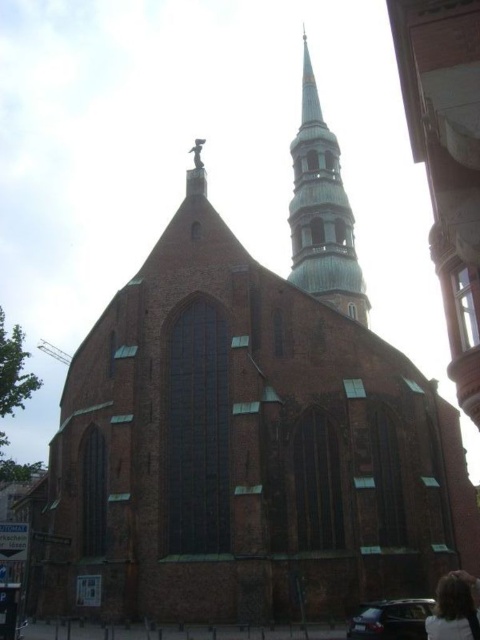
You are standing in front of the historic church and notice two points marked on its facade. The first point is located at coordinates point (349, 268), and the second at point (454, 580). Which of these points is closer to you?

Point (349, 268) is closer to you because it is further to the viewer than point (454, 580).

Based on the scene description, what object is located at the coordinates point (322, 211)?

The green copper spire at upper center is located at point (322, 211).

You are standing in front of the church and notice two elements in the image. One is the green copper spire at upper center and the other is the blonde hair at lower right. From your vantage point, which of these two elements is positioned to the left of the other?

The green copper spire at upper center is to the left of the blonde hair at lower right.